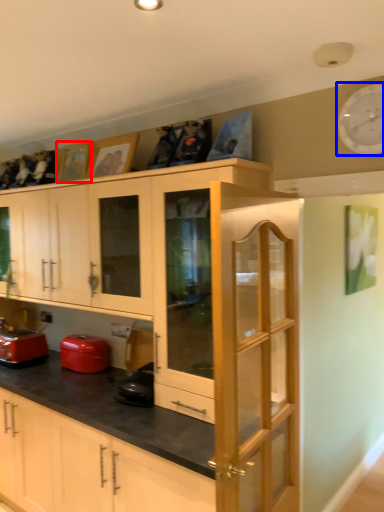
Question: Which of the following is the farthest to the observer, picture frame (highlighted by a red box) or clock (highlighted by a blue box)?

Choices:
 (A) picture frame
 (B) clock

Answer: (A)